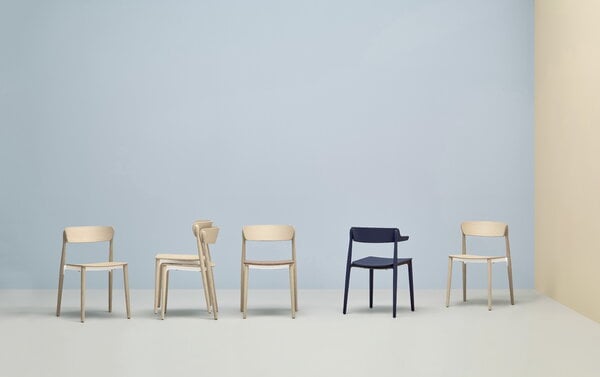
Where is `brown chairs`? brown chairs is located at coordinates (96, 235), (204, 236), (258, 230), (476, 224).